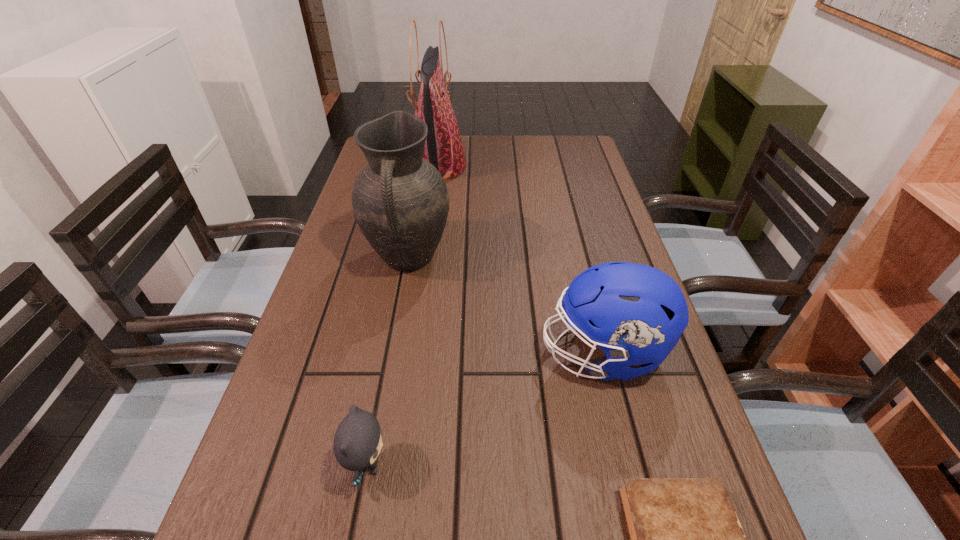
What are the coordinates of `free space located on the front-facing side of the third shortest object` in the screenshot? It's located at (504, 353).

Image resolution: width=960 pixels, height=540 pixels. In order to click on free space located on the front-facing side of the third shortest object in this screenshot , I will do `click(479, 353)`.

The height and width of the screenshot is (540, 960). Find the location of `free space located 0.170m on the front-facing side of the second shortest object`. free space located 0.170m on the front-facing side of the second shortest object is located at coordinates (495, 465).

I want to click on object that is at the far edge, so click(x=443, y=148).

Image resolution: width=960 pixels, height=540 pixels. I want to click on handbag at the left edge, so click(443, 148).

In order to click on pitcher that is at the left edge in this screenshot , I will do `click(400, 201)`.

The width and height of the screenshot is (960, 540). I want to click on kitten at the left edge, so click(357, 442).

Locate an element on the screen. Image resolution: width=960 pixels, height=540 pixels. object that is at the right edge is located at coordinates (636, 314).

Locate an element on the screen. Image resolution: width=960 pixels, height=540 pixels. object at the far left corner is located at coordinates (443, 148).

Find the location of a particular element. This screenshot has height=540, width=960. blank space at the far edge of the desktop is located at coordinates (501, 164).